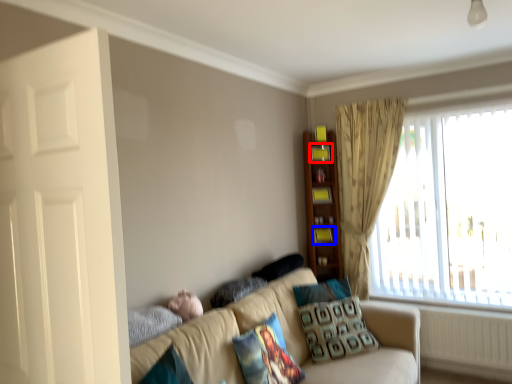
Question: Which of the following is the closest to the observer, shelf (highlighted by a red box) or shelf (highlighted by a blue box)?

Choices:
 (A) shelf
 (B) shelf

Answer: (A)